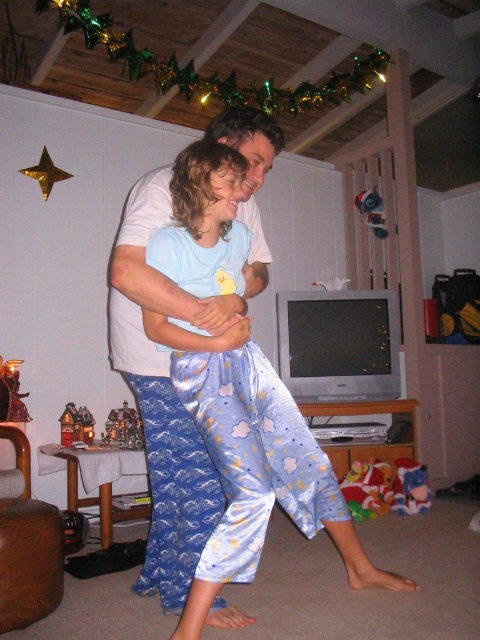
You are a photographer standing in the living room and want to take a photo of the blue satin pajama pants at center and the blue satin pajamas at center. Which one will appear larger in the photo?

The blue satin pajama pants at center will appear larger in the photo because it is closer to the viewer than the blue satin pajamas at center.

You are standing in the living room and want to reach the golden star decoration on the wall. The point where you are currently standing is labeled as point (160, 260). If you need to move 2 meters forward to reach the golden star decoration, will you be able to move from your current position to the golden star decoration without moving past it?

The distance between you and the point (160, 260) is 1.85 meters. Since you need to move 2 meters forward to reach the golden star decoration, you will move past the point (160, 260) and go beyond the golden star decoration by 0.15 meters. Therefore, you cannot stop exactly at the golden star decoration without moving past it.

You are standing in the living room and need to place a small gift under the blue satin pajama pants at center. Where should you position the gift relative to the pajama pants?

The blue satin pajama pants at center are located at point (204,221), so you should place the gift directly underneath them at the same x coordinate but lower y coordinate.